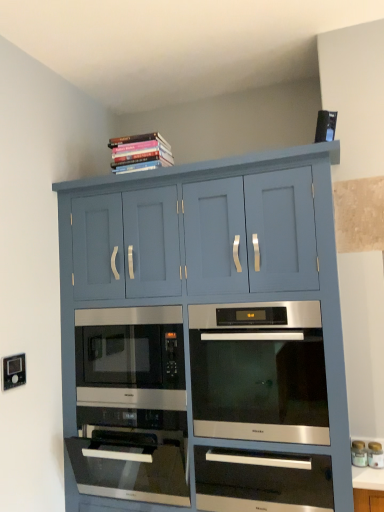
Question: Is white glossy jar at lower right, which is the 1th appliance from left to right, facing towards satin silver drawer at center?

Choices:
 (A) no
 (B) yes

Answer: (A)

Question: From a real-world perspective, is white glossy jar at lower right, which is the 1th appliance from left to right, positioned under satin silver drawer at center based on gravity?

Choices:
 (A) yes
 (B) no

Answer: (B)

Question: Considering the relative sizes of white glossy jar at lower right, positioned as the 2th appliance in right-to-left order, and satin silver drawer at center in the image provided, is white glossy jar at lower right, positioned as the 2th appliance in right-to-left order, shorter than satin silver drawer at center?

Choices:
 (A) yes
 (B) no

Answer: (A)

Question: From the image's perspective, is white glossy jar at lower right, which is the 1th appliance from left to right, on top of satin silver drawer at center?

Choices:
 (A) no
 (B) yes

Answer: (B)

Question: Considering the relative sizes of white glossy jar at lower right, which is the 1th appliance from left to right, and satin silver drawer at center in the image provided, is white glossy jar at lower right, which is the 1th appliance from left to right, thinner than satin silver drawer at center?

Choices:
 (A) yes
 (B) no

Answer: (A)

Question: Is satin silver oven at center situated inside matte blue cabinet at upper center or outside?

Choices:
 (A) inside
 (B) outside

Answer: (A)

Question: Would you say satin silver oven at center is to the left or to the right of matte blue cabinet at upper center in the picture?

Choices:
 (A) left
 (B) right

Answer: (B)

Question: In terms of width, does satin silver oven at center look wider or thinner when compared to matte blue cabinet at upper center?

Choices:
 (A) thin
 (B) wide

Answer: (A)

Question: Does point (306, 374) appear closer or farther from the camera than point (337, 495)?

Choices:
 (A) farther
 (B) closer

Answer: (A)

Question: From a real-world perspective, is hardcover books at upper center above or below white glossy countertop at lower right?

Choices:
 (A) above
 (B) below

Answer: (A)

Question: Is hardcover books at upper center in front of or behind white glossy countertop at lower right in the image?

Choices:
 (A) behind
 (B) front

Answer: (A)

Question: Is point (167, 142) closer or farther from the camera than point (362, 475)?

Choices:
 (A) closer
 (B) farther

Answer: (B)

Question: In terms of width, does hardcover books at upper center look wider or thinner when compared to white glossy countertop at lower right?

Choices:
 (A) thin
 (B) wide

Answer: (A)

Question: From a real-world perspective, is satin silver drawer at center physically located above or below matte blue cabinet at upper center?

Choices:
 (A) below
 (B) above

Answer: (A)

Question: Is satin silver drawer at center in front of or behind matte blue cabinet at upper center in the image?

Choices:
 (A) front
 (B) behind

Answer: (B)